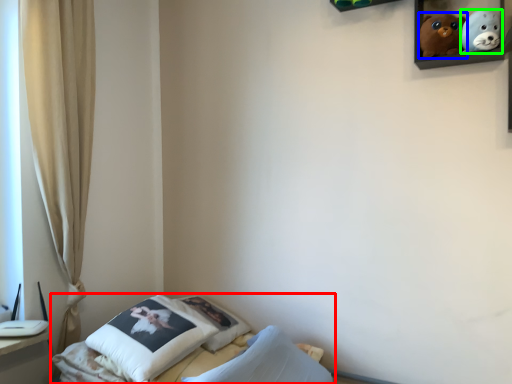
Question: Which object is the farthest from bed (highlighted by a red box)? Choose among these: toy (highlighted by a blue box) or toy (highlighted by a green box).

Choices:
 (A) toy
 (B) toy

Answer: (B)